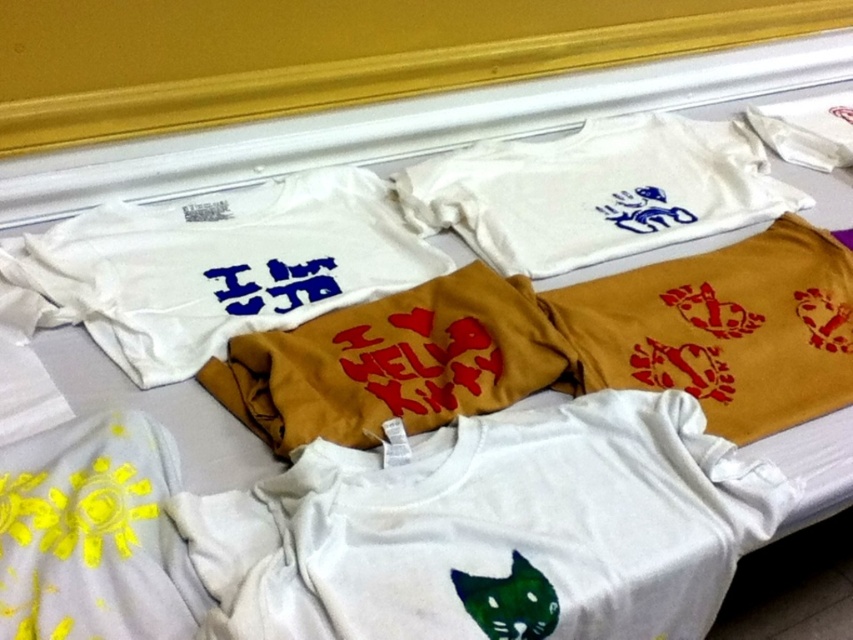
Question: Which object appears farthest from the camera in this image?

Choices:
 (A) orange matte t-shirt at center
 (B) matte gold t-shirt at center

Answer: (A)

Question: Which is farther from the matte gold t-shirt at center?

Choices:
 (A) white cotton t-shirt at center
 (B) yellow fabric pillow at lower left
 (C) white cotton t-shirt at upper left

Answer: (B)

Question: Can you confirm if matte gold t-shirt at center is bigger than yellow fabric pillow at lower left?

Choices:
 (A) yes
 (B) no

Answer: (A)

Question: Does white cotton t-shirt at center appear on the right side of yellow fabric pillow at lower left?

Choices:
 (A) no
 (B) yes

Answer: (B)

Question: Does white cotton t-shirt at center have a lesser width compared to white cotton t-shirt at upper left?

Choices:
 (A) no
 (B) yes

Answer: (A)

Question: Which object is the closest to the orange matte t-shirt at center?

Choices:
 (A) white cotton t-shirt at upper left
 (B) matte gold t-shirt at center
 (C) white cotton t-shirt at center
 (D) yellow fabric pillow at lower left

Answer: (B)